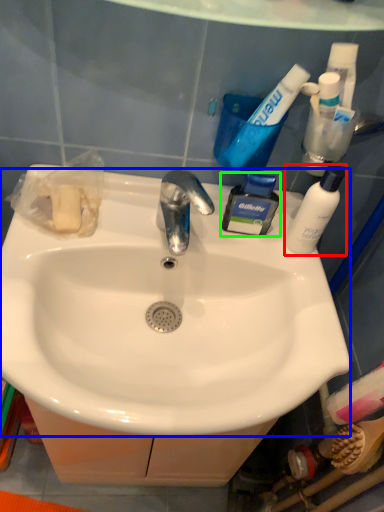
Question: Based on their relative distances, which object is nearer to bottle (highlighted by a red box)? Choose from sink (highlighted by a blue box) and toiletry (highlighted by a green box).

Choices:
 (A) sink
 (B) toiletry

Answer: (B)